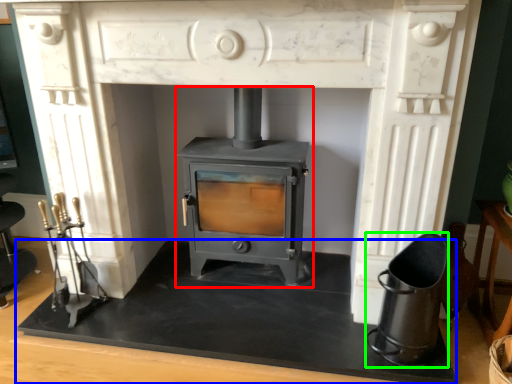
Question: Estimate the real-world distances between objects in this image. Which object is farther from wood burning stove (highlighted by a red box), slate (highlighted by a blue box) or appliance (highlighted by a green box)?

Choices:
 (A) slate
 (B) appliance

Answer: (B)